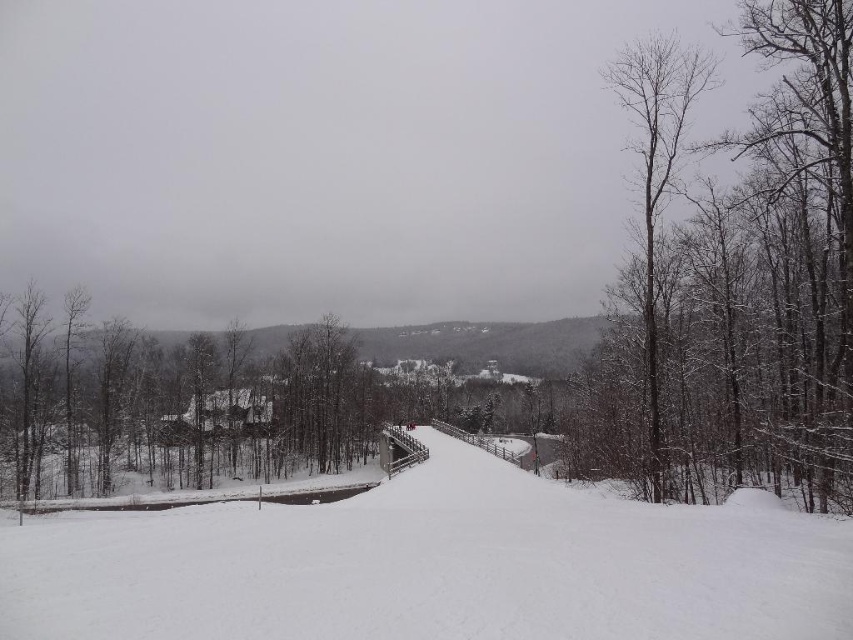
Is point (126, 529) behind point (664, 380)?

No, it is in front of (664, 380).

Describe the element at coordinates (434, 564) in the screenshot. I see `white snow ski slope at center` at that location.

I want to click on white snow ski slope at center, so click(434, 564).

Is the position of white snow ski slope at center more distant than that of bare wood tree at right?

No, white snow ski slope at center is in front of bare wood tree at right.

Between white snow ski slope at center and bare wood tree at right, which one appears on the left side from the viewer's perspective?

white snow ski slope at center is more to the left.

At what (x,y) coordinates should I click in order to perform the action: click on white snow ski slope at center. Please return your answer as a coordinate pair (x, y). This screenshot has width=853, height=640. Looking at the image, I should click on (434, 564).

Is snow-covered bare tree at right closer to the viewer compared to bare wood tree at right?

That is True.

Is the position of snow-covered bare tree at right more distant than that of bare wood tree at right?

No.

Find the location of a particular element. The width and height of the screenshot is (853, 640). snow-covered bare tree at right is located at coordinates (735, 282).

Identify the location of snow-covered bare tree at right. This screenshot has width=853, height=640. (735, 282).